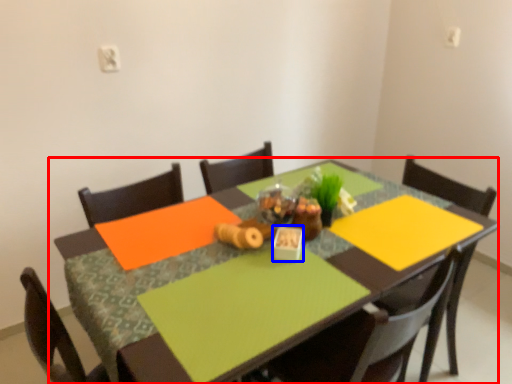
Question: Which object is further to the camera taking this photo, table (highlighted by a red box) or tableware (highlighted by a blue box)?

Choices:
 (A) table
 (B) tableware

Answer: (B)